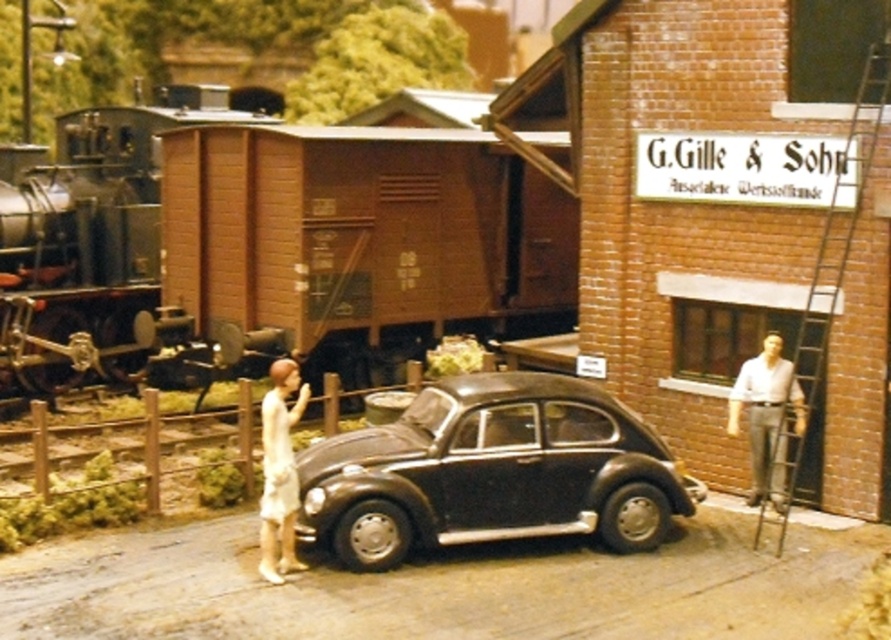
You are a model railway enthusiast examining the diorama. You notice the brown wooden train at center and the light blue shirt at right. Which object occupies more horizontal space in the scene?

The brown wooden train at center occupies more horizontal space than the light blue shirt at right because its width surpasses the shirt.

You are a model train enthusiast looking at the miniature diorama. You see the matte black car at center and the light blue shirt at right. Which object is closer to the front of the scene?

The matte black car at center is closer to the front of the scene because it is positioned under the light blue shirt at right, indicating it is in a lower, more forward position.